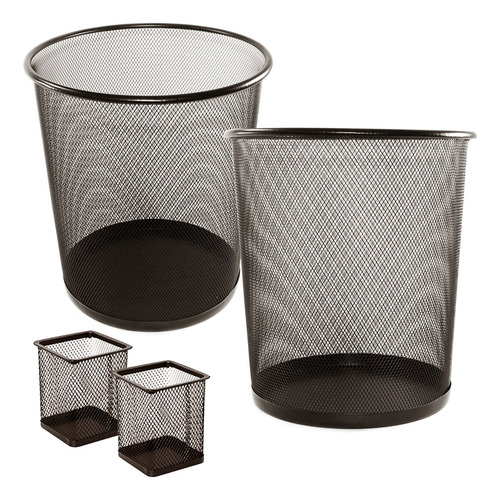
This screenshot has width=500, height=500. I want to click on trash can, so click(x=175, y=244), click(x=367, y=353), click(x=173, y=426), click(x=76, y=392).